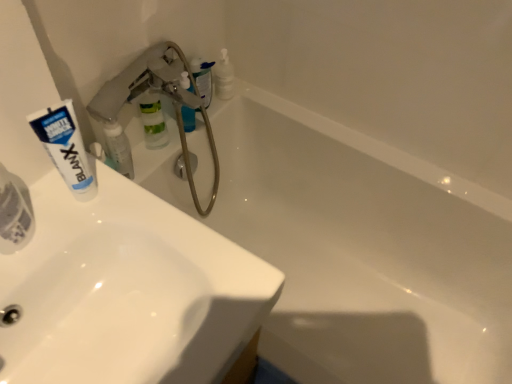
Question: Is white glossy sink at upper left, which is counted as the first sink, starting from the front, wider or thinner than white glossy sink at upper left, positioned as the second sink in front-to-back order?

Choices:
 (A) thin
 (B) wide

Answer: (A)

Question: Based on their sizes in the image, would you say white glossy sink at upper left, the 2th sink positioned from the back, is bigger or smaller than white glossy sink at upper left, acting as the first sink starting from the back?

Choices:
 (A) small
 (B) big

Answer: (A)

Question: Estimate the real-world distances between objects in this image. Which object is closer to the translucent plastic bottle at upper center, placed as the 4th toiletry when sorted from front to back?

Choices:
 (A) white glossy toothpaste tube at upper left, placed as the 2th toiletry when sorted from front to back
 (B) white glossy sink at upper left, acting as the first sink starting from the back
 (C) white glossy sink at upper left, the 2th sink positioned from the back
 (D) translucent plastic toothpaste tube at left, the 1th toiletry viewed from the front
 (E) white matte tube at upper left

Answer: (A)

Question: Considering the real-world distances, which object is closest to the white glossy toothpaste tube at upper left, acting as the third toiletry starting from the back?

Choices:
 (A) white glossy sink at upper left, acting as the first sink starting from the back
 (B) translucent plastic soap dispenser at upper center, which is the third toiletry in front-to-back order
 (C) translucent plastic bottle at upper center, placed as the 4th toiletry when sorted from front to back
 (D) white glossy sink at upper left, which is counted as the first sink, starting from the front
 (E) translucent plastic toothpaste tube at left, placed as the fourth toiletry when sorted from back to front

Answer: (B)